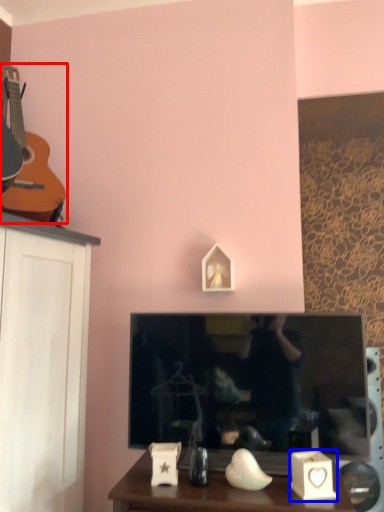
Question: Which object is further to the camera taking this photo, guitar (highlighted by a red box) or candle holder (highlighted by a blue box)?

Choices:
 (A) guitar
 (B) candle holder

Answer: (A)